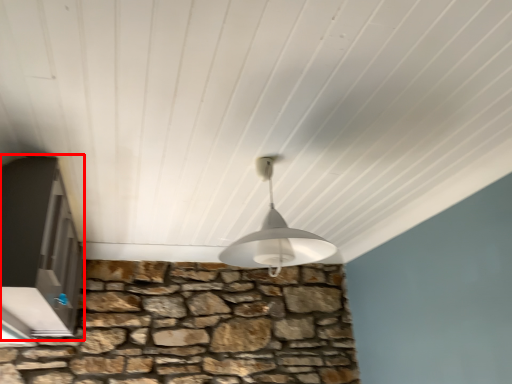
Question: From the image's perspective, what is the correct spatial relationship of window (annotated by the red box) in relation to lamp?

Choices:
 (A) above
 (B) below

Answer: (B)